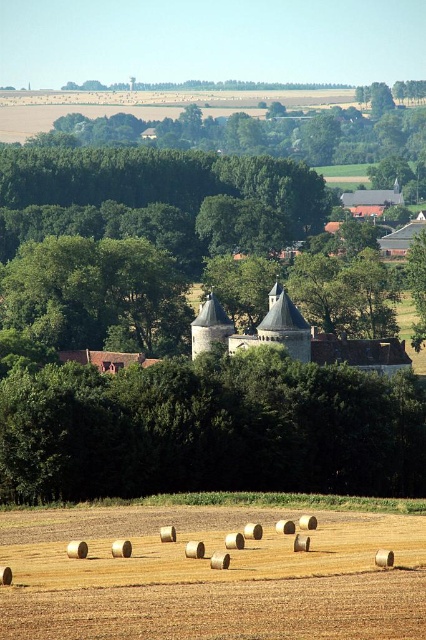
Question: Based on their relative distances, which object is farther from the green leafy tree at center?

Choices:
 (A) brown stone castle at center
 (B) golden straw bales at lower center

Answer: (A)

Question: Does green leafy tree at center lie behind brown stone castle at center?

Choices:
 (A) no
 (B) yes

Answer: (A)

Question: Is golden straw bales at lower center to the left of brown stone castle at center from the viewer's perspective?

Choices:
 (A) no
 (B) yes

Answer: (B)

Question: Is golden straw bales at lower center to the right of brown stone castle at center from the viewer's perspective?

Choices:
 (A) yes
 (B) no

Answer: (B)

Question: Which object is positioned closest to the golden straw bales at lower center?

Choices:
 (A) green leafy tree at center
 (B) brown stone castle at center

Answer: (A)

Question: Based on their relative distances, which object is nearer to the golden straw bales at lower center?

Choices:
 (A) brown stone castle at center
 (B) green leafy tree at center

Answer: (B)